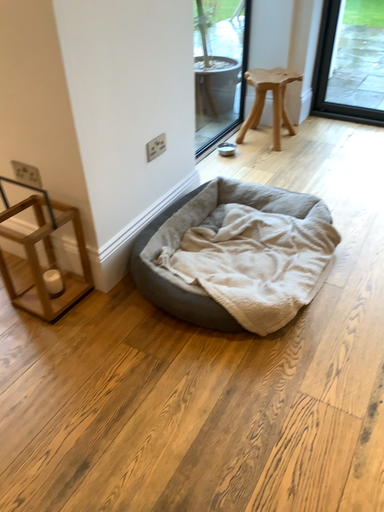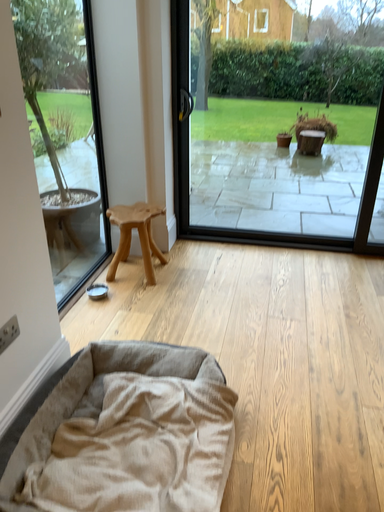
Question: Which way did the camera rotate in the video?

Choices:
 (A) rotated downward
 (B) rotated upward

Answer: (B)